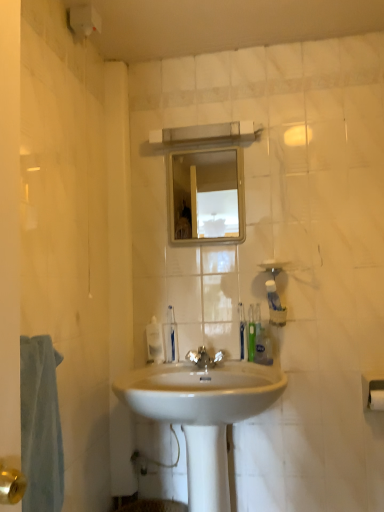
The height and width of the screenshot is (512, 384). Describe the element at coordinates (275, 305) in the screenshot. I see `translucent plastic soap dispenser at upper right, which ranks as the 1th toiletry in right-to-left order` at that location.

Measure the distance between white plastic toothbrush at center, placed as the fifth toiletry when sorted from right to left, and camera.

white plastic toothbrush at center, placed as the fifth toiletry when sorted from right to left, and camera are 1.76 meters apart from each other.

How much space does white plastic toothbrush at center, placed as the fifth toiletry when sorted from right to left, occupy horizontally?

white plastic toothbrush at center, placed as the fifth toiletry when sorted from right to left, is 3.15 centimeters in width.

This screenshot has width=384, height=512. Describe the element at coordinates (204, 358) in the screenshot. I see `polished chrome faucet at center` at that location.

What is the approximate width of clear glass mirror at upper center?

clear glass mirror at upper center is 0.87 inches in width.

Where is `clear glass mirror at upper center`? The width and height of the screenshot is (384, 512). clear glass mirror at upper center is located at coordinates (206, 197).

Measure the distance between white matte toilet paper at lower right and camera.

5.32 feet.

Locate an element on the screen. The image size is (384, 512). translucent plastic soap dispenser at upper right, which ranks as the 1th toiletry in right-to-left order is located at coordinates (x=275, y=305).

Image resolution: width=384 pixels, height=512 pixels. What are the coordinates of `soap on the left side of translucent plastic soap dispenser at upper right, which ranks as the 1th toiletry in right-to-left order` in the screenshot? It's located at (269, 263).

Can you see white matte soap at center touching translucent plastic soap dispenser at upper right, which ranks as the 1th toiletry in right-to-left order?

No, white matte soap at center is not making contact with translucent plastic soap dispenser at upper right, which ranks as the 1th toiletry in right-to-left order.

Could you tell me if white matte soap at center is turned towards translucent plastic soap dispenser at upper right, which ranks as the 1th toiletry in right-to-left order?

No, white matte soap at center does not turn towards translucent plastic soap dispenser at upper right, which ranks as the 1th toiletry in right-to-left order.

Is white matte soap at center outside of translucent plastic soap dispenser at upper right, the fifth toiletry viewed from the left?

Yes, white matte soap at center is not within translucent plastic soap dispenser at upper right, the fifth toiletry viewed from the left.

Is point (176, 375) behind point (153, 352)?

No, (176, 375) is closer to viewer.

Is there a large distance between white glossy sink at center and translucent plastic soap dispenser at center?

No, white glossy sink at center is in close proximity to translucent plastic soap dispenser at center.

Which of these two, white glossy sink at center or translucent plastic soap dispenser at center, is smaller?

With smaller size is translucent plastic soap dispenser at center.

Which of these two, translucent plastic soap dispenser at center or white matte soap at center, is wider?

With larger width is white matte soap at center.

What's the angular difference between translucent plastic soap dispenser at center and white matte soap at center's facing directions?

0.586 degrees.

From a real-world perspective, which is physically above, translucent plastic soap dispenser at center or white matte soap at center?

In real-world perspective, white matte soap at center is above.

Is white matte soap at center beside green plastic toothbrush at right, arranged as the 3th toiletry when viewed from the right?

They are not placed beside each other.

Consider the image. Considering the sizes of objects white matte soap at center and green plastic toothbrush at right, positioned as the third toiletry in left-to-right order, in the image provided, who is taller, white matte soap at center or green plastic toothbrush at right, positioned as the third toiletry in left-to-right order,?

green plastic toothbrush at right, positioned as the third toiletry in left-to-right order, is taller.

Is white matte soap at center smaller than green plastic toothbrush at right, positioned as the third toiletry in left-to-right order?

Yes, white matte soap at center is smaller than green plastic toothbrush at right, positioned as the third toiletry in left-to-right order.

Is white matte soap at center not inside green plastic toothbrush at right, arranged as the 3th toiletry when viewed from the right?

Yes, white matte soap at center is outside of green plastic toothbrush at right, arranged as the 3th toiletry when viewed from the right.

Considering the sizes of objects white matte toilet paper at lower right and light blue cotton towel at left in the image provided, who is bigger, white matte toilet paper at lower right or light blue cotton towel at left?

Bigger between the two is light blue cotton towel at left.

This screenshot has width=384, height=512. What are the coordinates of `toilet paper located below the light blue cotton towel at left (from the image's perspective)` in the screenshot? It's located at (376, 400).

Looking at this image, is white matte toilet paper at lower right oriented towards light blue cotton towel at left?

No, white matte toilet paper at lower right is not turned towards light blue cotton towel at left.

Does white matte toilet paper at lower right have a lesser width compared to light blue cotton towel at left?

Indeed, white matte toilet paper at lower right has a lesser width compared to light blue cotton towel at left.

Is green plastic toothbrush at center, marked as the 2th toiletry in a left-to-right arrangement, spatially inside white matte toilet paper at lower right, or outside of it?

green plastic toothbrush at center, marked as the 2th toiletry in a left-to-right arrangement, exists outside the volume of white matte toilet paper at lower right.

Locate an element on the screen. The width and height of the screenshot is (384, 512). toilet paper beneath the green plastic toothbrush at center, marked as the fourth toiletry in a right-to-left arrangement (from a real-world perspective) is located at coordinates [376, 400].

In terms of width, does green plastic toothbrush at center, marked as the 2th toiletry in a left-to-right arrangement, look wider or thinner when compared to white matte toilet paper at lower right?

Considering their sizes, green plastic toothbrush at center, marked as the 2th toiletry in a left-to-right arrangement, looks slimmer than white matte toilet paper at lower right.

Is green plastic toothbrush at center, marked as the fourth toiletry in a right-to-left arrangement, bigger than white matte toilet paper at lower right?

No.

From a real-world perspective, who is located lower, green plastic toothbrush at center, marked as the 2th toiletry in a left-to-right arrangement, or white plastic toothbrush at center, which is counted as the 1th toiletry, starting from the left?

From a 3D spatial view, white plastic toothbrush at center, which is counted as the 1th toiletry, starting from the left, is below.

Between point (244, 352) and point (173, 312), which one is positioned behind?

The point (173, 312) is farther.

Locate an element on the screen. the 1st toiletry below the green plastic toothbrush at center, marked as the fourth toiletry in a right-to-left arrangement (from the image's perspective) is located at coordinates (171, 337).

Does green plastic toothbrush at center, marked as the fourth toiletry in a right-to-left arrangement, appear on the right side of white plastic toothbrush at center, placed as the fifth toiletry when sorted from right to left?

Yes.

The image size is (384, 512). In order to click on the 1st toiletry below the white matte soap at center (from the image's perspective) in this screenshot , I will do `click(275, 305)`.

Where is `soap dispenser that appears on the left of white glossy sink at center`? soap dispenser that appears on the left of white glossy sink at center is located at coordinates (154, 341).

Looking at the image, which one is located further to green plastic toothbrush at right, arranged as the 3th toiletry when viewed from the right, polished chrome faucet at center or clear glass mirror at upper center?

The object further to green plastic toothbrush at right, arranged as the 3th toiletry when viewed from the right, is clear glass mirror at upper center.

From the image, which object appears to be nearer to clear glass mirror at upper center, light blue cotton towel at left or green plastic toothbrush at center, marked as the 2th toiletry in a left-to-right arrangement?

Among the two, green plastic toothbrush at center, marked as the 2th toiletry in a left-to-right arrangement, is located nearer to clear glass mirror at upper center.

Which object lies further to the anchor point clear glass mirror at upper center, polished chrome faucet at center or green plastic toothbrush at right, arranged as the 3th toiletry when viewed from the right?

polished chrome faucet at center lies further to clear glass mirror at upper center than the other object.

From the image, which object appears to be farther from clear glass mirror at upper center, white matte toilet paper at lower right or green plastic toothbrush at right, positioned as the third toiletry in left-to-right order?

Based on the image, white matte toilet paper at lower right appears to be further to clear glass mirror at upper center.

Which object lies nearer to the anchor point white matte toilet paper at lower right, translucent plastic soap dispenser at upper right, which ranks as the 1th toiletry in right-to-left order, or polished chrome faucet at center?

Based on the image, translucent plastic soap dispenser at upper right, which ranks as the 1th toiletry in right-to-left order, appears to be nearer to white matte toilet paper at lower right.

In the scene shown: Considering their positions, is light blue cotton towel at left positioned closer to clear glass mirror at upper center than translucent plastic soap dispenser at upper right, which ranks as the 1th toiletry in right-to-left order?

Based on the image, translucent plastic soap dispenser at upper right, which ranks as the 1th toiletry in right-to-left order, appears to be nearer to clear glass mirror at upper center.

Looking at this image, estimate the real-world distances between objects in this image. Which object is further from white glossy sink at center, light blue cotton towel at left or white matte soap at center?

white matte soap at center lies further to white glossy sink at center than the other object.

Looking at the image, which one is located further to polished chrome faucet at center, clear glass mirror at upper center or green plastic toothbrush at center, marked as the 2th toiletry in a left-to-right arrangement?

clear glass mirror at upper center is further to polished chrome faucet at center.

This screenshot has width=384, height=512. I want to click on mirror between light blue cotton towel at left and translucent plastic soap dispenser at center along the z-axis, so click(x=206, y=197).

This screenshot has height=512, width=384. I want to click on soap between light blue cotton towel at left and white matte toilet paper at lower right, so click(x=269, y=263).

Locate an element on the screen. toiletry located between green matte toothpaste tube at center, marked as the fourth toiletry in a left-to-right arrangement, and white matte toilet paper at lower right in the left-right direction is located at coordinates (275, 305).

I want to click on soap situated between white plastic toothbrush at center, which is counted as the 1th toiletry, starting from the left, and white matte toilet paper at lower right from left to right, so click(x=269, y=263).